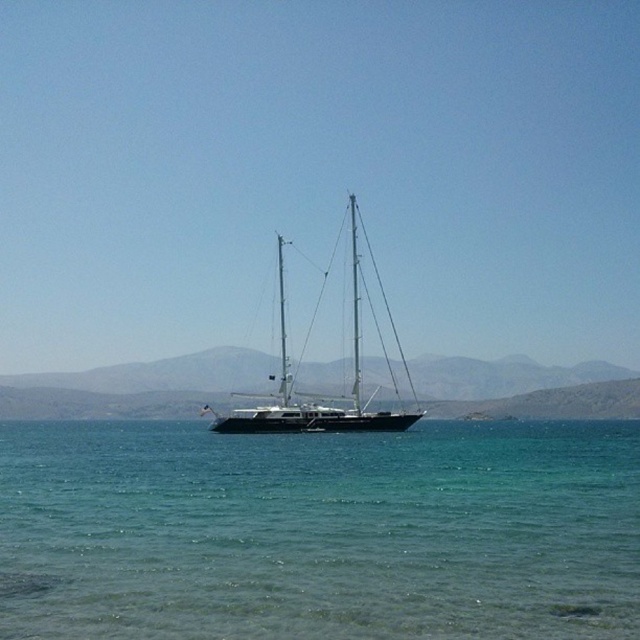
Who is more distant from viewer, (397, 556) or (356, 324)?

Point (356, 324)

Who is more forward, (380, 628) or (250, 413)?

Point (380, 628) is more forward.

What are the coordinates of `clear water at center` in the screenshot? It's located at (320, 532).